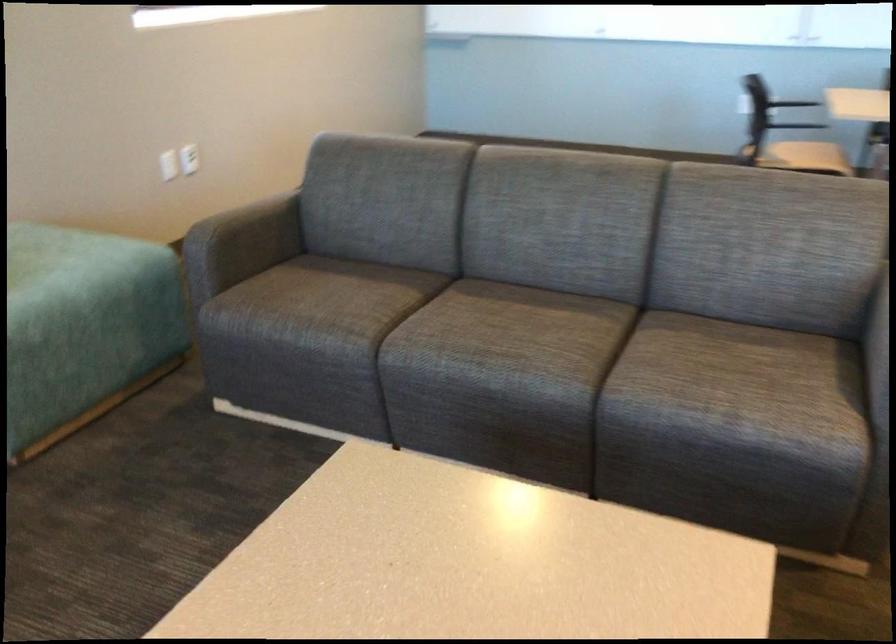
Identify the location of green sitting surface. (56, 251).